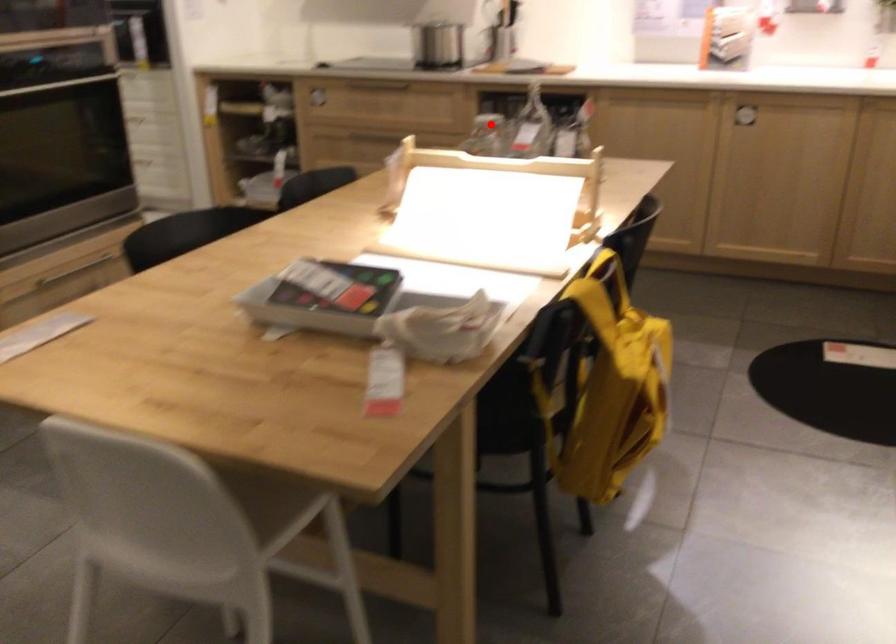
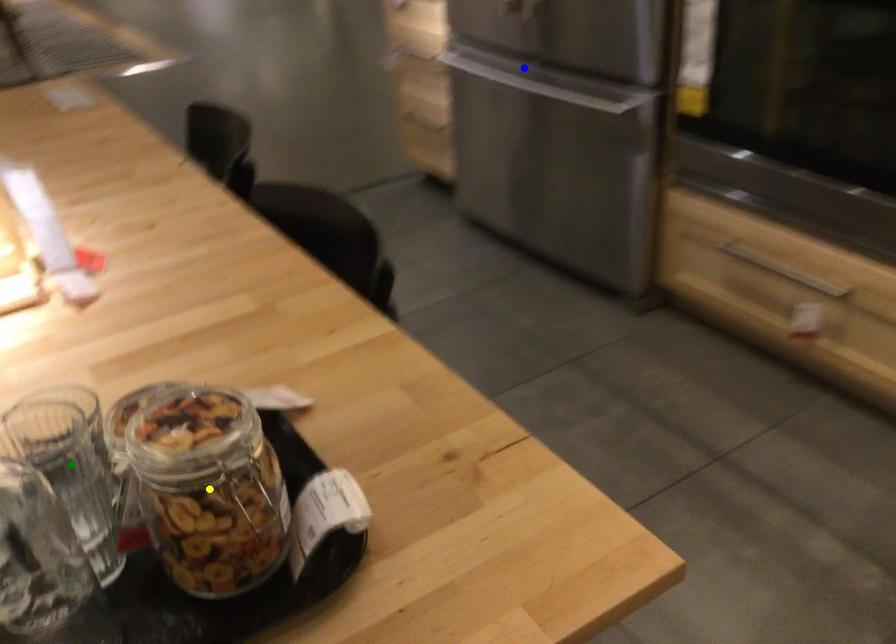
Question: I am providing you with two images of the same scene from different viewpoints. A red point is marked on the first image. You are given multiple points on the second image. Which point in image 2 represents the same 3d spot as the red point in image 1?

Choices:
 (A) yellow point
 (B) blue point
 (C) green point

Answer: (A)